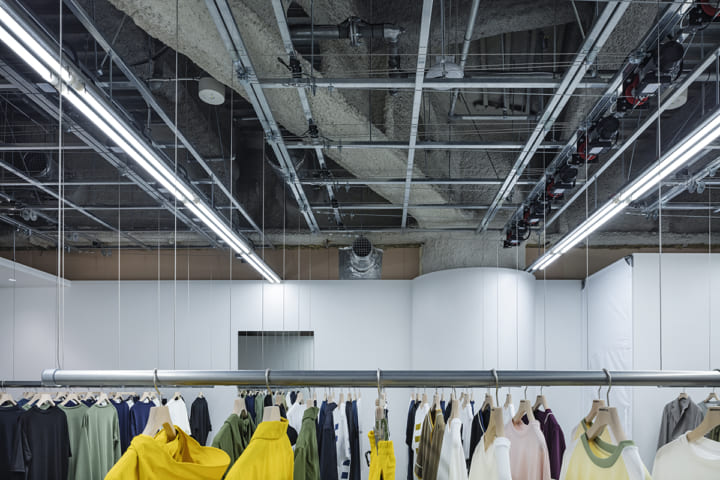
Where is `rack`? The image size is (720, 480). rack is located at coordinates (476, 377).